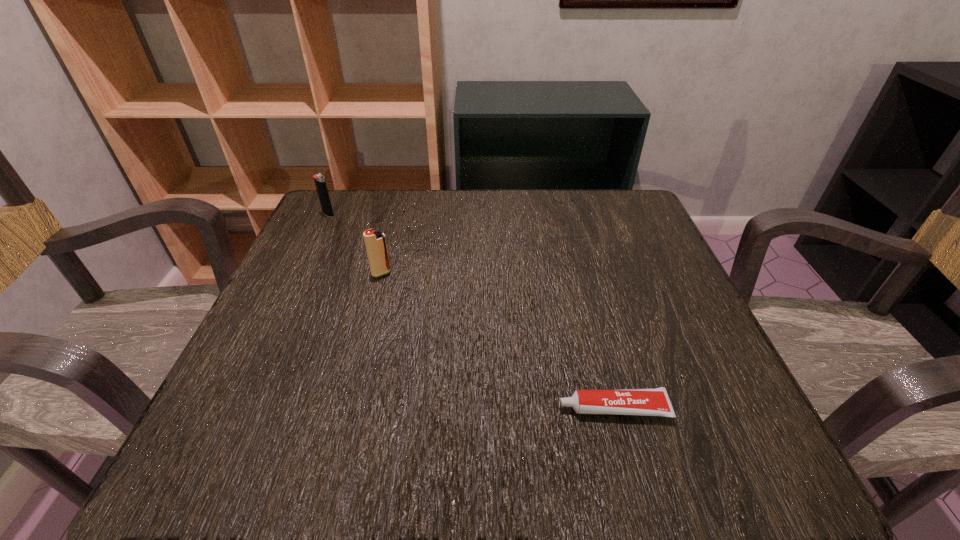
At what (x,y) coordinates should I click in order to perform the action: click on vacant space located 0.290m at the nozzle of the shortest object. Please return your answer as a coordinate pair (x, y). Looking at the image, I should click on (366, 408).

This screenshot has width=960, height=540. What are the coordinates of `object that is positioned at the far edge` in the screenshot? It's located at (320, 183).

Where is `object present at the near edge`? This screenshot has width=960, height=540. object present at the near edge is located at coordinates (647, 402).

At what (x,y) coordinates should I click in order to perform the action: click on object positioned at the left edge. Please return your answer as a coordinate pair (x, y). This screenshot has width=960, height=540. Looking at the image, I should click on (320, 183).

This screenshot has height=540, width=960. Identify the location of object positioned at the right edge. (647, 402).

Image resolution: width=960 pixels, height=540 pixels. Find the location of `object that is at the far left corner`. object that is at the far left corner is located at coordinates (320, 183).

The width and height of the screenshot is (960, 540). Find the location of `object present at the near right corner`. object present at the near right corner is located at coordinates (647, 402).

Where is `free space at the far edge`? The height and width of the screenshot is (540, 960). free space at the far edge is located at coordinates (525, 190).

The width and height of the screenshot is (960, 540). In order to click on vacant region at the near edge of the desktop in this screenshot , I will do `click(493, 428)`.

Image resolution: width=960 pixels, height=540 pixels. Find the location of `vacant region at the left edge`. vacant region at the left edge is located at coordinates (333, 276).